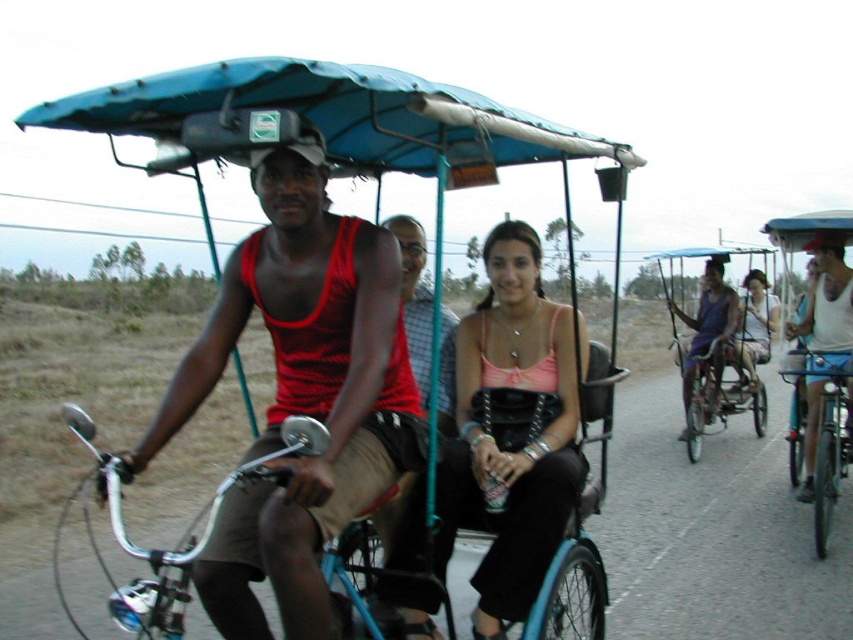
Question: Does matte blue rickshaw at center have a greater width compared to metallic blue bicycle at right?

Choices:
 (A) yes
 (B) no

Answer: (A)

Question: Which of the following is the closest to the observer?

Choices:
 (A) (370, 385)
 (B) (474, 451)

Answer: (A)

Question: Which object appears farthest from the camera in this image?

Choices:
 (A) blue fabric bicycle at center
 (B) red tank top at center
 (C) blue fabric canopy at upper center
 (D) matte pink tank top at center

Answer: (D)

Question: Which object is closer to the camera taking this photo?

Choices:
 (A) blue fabric canopy at upper center
 (B) blue matte tricycle at center
 (C) shiny chrome handlebars at center
 (D) matte blue rickshaw at center

Answer: (C)

Question: Can you confirm if shiny chrome handlebars at center is wider than blue fabric bicycle at center?

Choices:
 (A) yes
 (B) no

Answer: (B)

Question: Can you confirm if blue fabric canopy at upper center is wider than pink fabric purse at center?

Choices:
 (A) no
 (B) yes

Answer: (B)